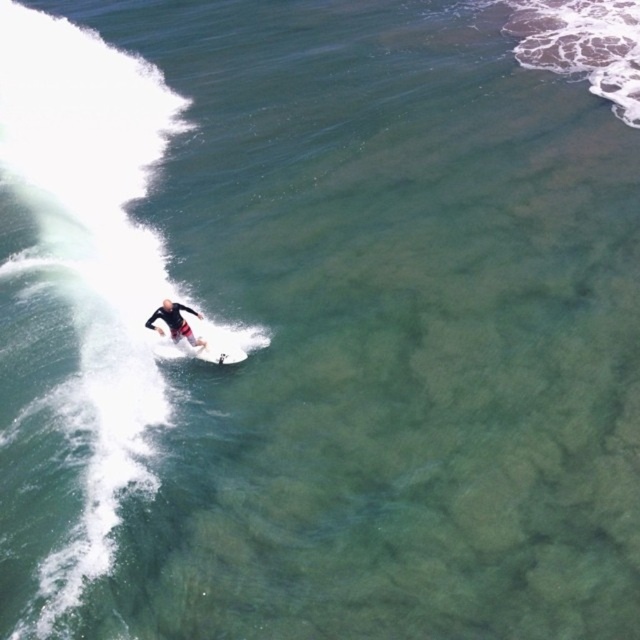
You are a photographer trying to capture a photo of the black wetsuit surfer at center and the white foam surfboard at center. You want to ensure both are fully visible in the frame. If the camera can only focus on one object at a time, which object should you focus on to ensure the entire object is in focus?

The white foam surfboard at center might be wider than black wetsuit surfer at center, so focusing on the wider object would ensure the entire object is in focus.

You are a photographer trying to capture the surfer in the image. The surfer is at point (x=202, y=349). Where is the white foam surfboard located relative to the surfer?

The white foam surfboard is located at the center of the image, corresponding to point (x=202, y=349).